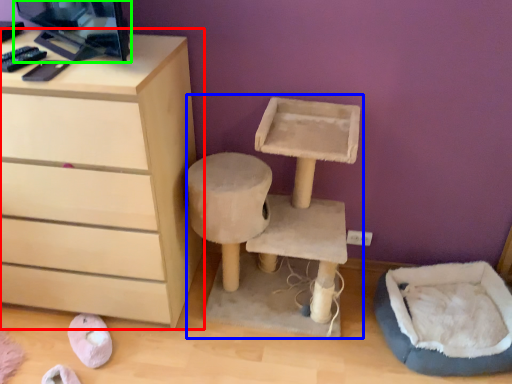
Question: Which is nearer to the chest of drawers (highlighted by a red box)? computer desk (highlighted by a blue box) or desktop computer (highlighted by a green box).

Choices:
 (A) computer desk
 (B) desktop computer

Answer: (B)